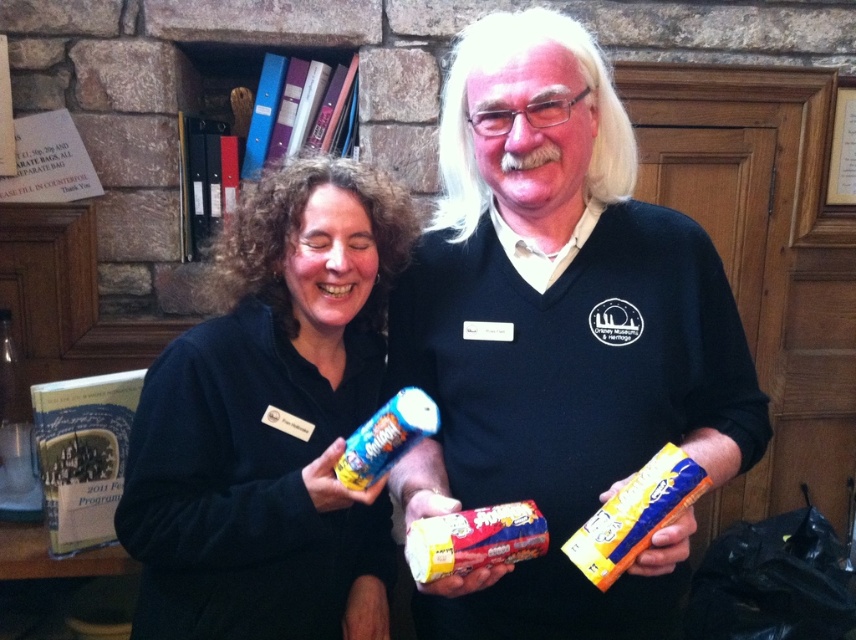
You are a delivery person who needs to place a new snack in the center of the table. The table is 3 inches wide. You have two snacks to choose from, the yellow paper snack at center and the matte plastic snack at center. Which snack can you place on the table without overlapping the edges?

Both snacks are 4.11 inches apart from each other, so neither will fit on a 3 inch wide table since they are wider than the table.

You are a photographer taking a picture of the two individuals in the library. You notice two points of interest marked as point (504,605) and point (369,433). Which point is closer to the camera?

Point (369,433) is closer to the camera because it is less further than point (504,605).